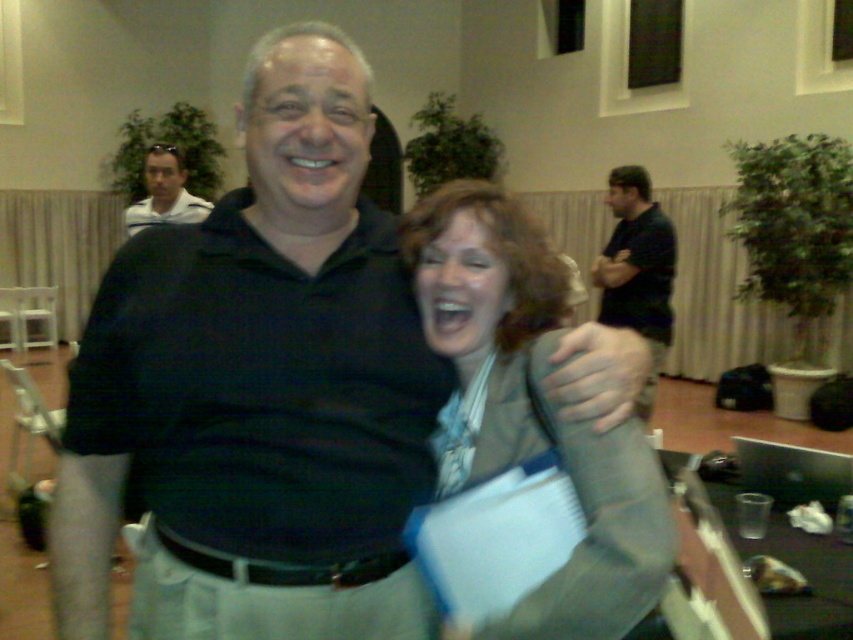
Is black matte shirt at center to the left of matte white shirt at upper left from the viewer's perspective?

Incorrect, black matte shirt at center is not on the left side of matte white shirt at upper left.

Which is below, black matte shirt at center or matte white shirt at upper left?

black matte shirt at center is lower down.

Between point (341, 424) and point (154, 205), which one is positioned behind?

The point (154, 205) is more distant.

Find the location of a particular element. The image size is (853, 640). black matte shirt at center is located at coordinates (258, 388).

This screenshot has width=853, height=640. Describe the element at coordinates (531, 410) in the screenshot. I see `matte gray blazer at center` at that location.

Is matte gray blazer at center further to camera compared to matte white shirt at upper left?

No, matte gray blazer at center is in front of matte white shirt at upper left.

This screenshot has height=640, width=853. What are the coordinates of `matte gray blazer at center` in the screenshot? It's located at [x=531, y=410].

This screenshot has width=853, height=640. What are the coordinates of `matte gray blazer at center` in the screenshot? It's located at (531, 410).

Which is below, black matte shirt at center or matte gray blazer at center?

matte gray blazer at center

Is point (173, 300) in front of point (653, 452)?

No, it is behind (653, 452).

Is point (113, 504) closer to viewer compared to point (488, 200)?

Yes, it is.

I want to click on black matte shirt at center, so click(x=258, y=388).